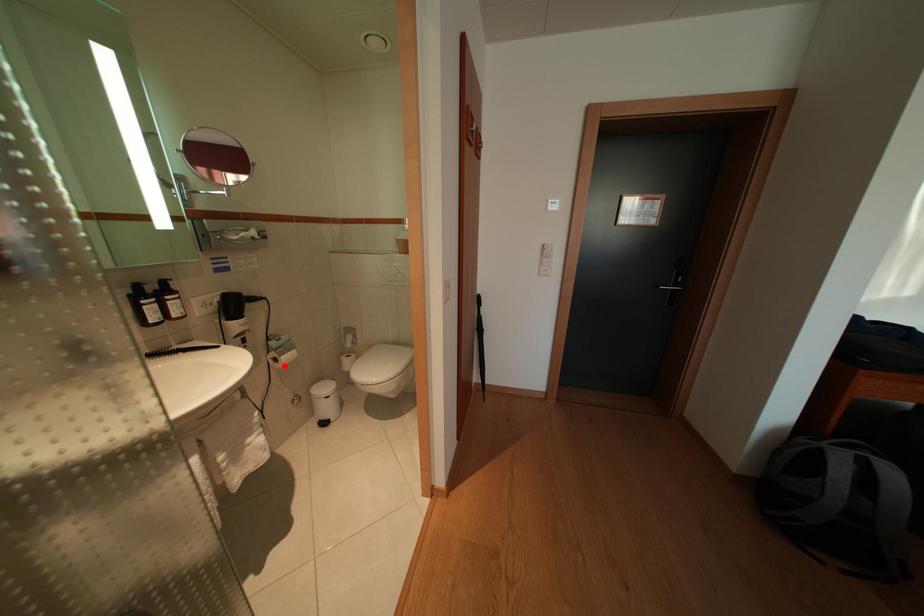
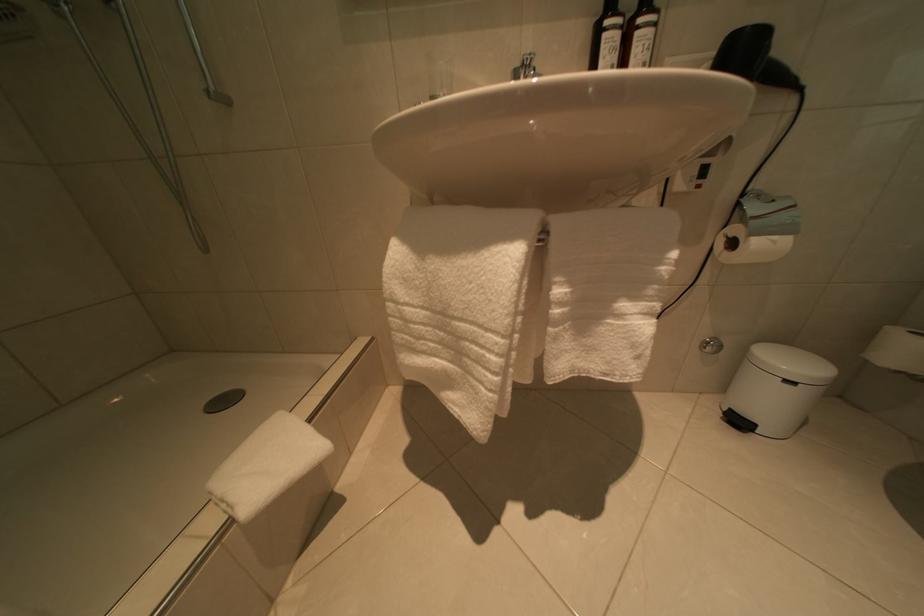
In the second image, find the point that corresponds to the highlighted location in the first image.

(740, 249)